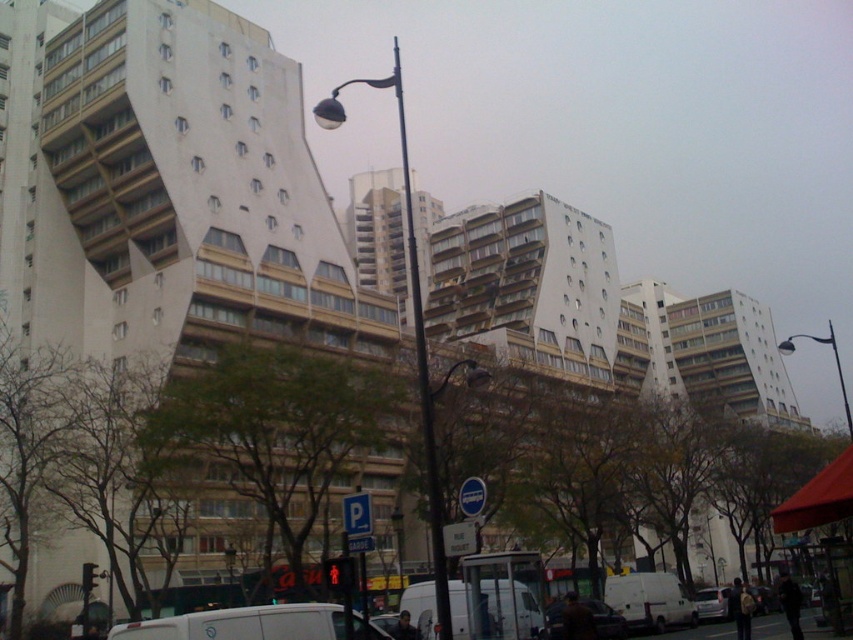
Question: Considering the real-world distances, which object is farthest from the white matte van at lower center?

Choices:
 (A) matte black street light at center
 (B) metallic pole at right
 (C) black metal pole at center
 (D) silver metallic van at lower right

Answer: (B)

Question: Is black metal pole at center positioned before metallic silver car at center?

Choices:
 (A) no
 (B) yes

Answer: (B)

Question: Does matte black street light at center lie in front of white matte van at lower center?

Choices:
 (A) yes
 (B) no

Answer: (B)

Question: Which point is farther to the camera?

Choices:
 (A) (704, 593)
 (B) (248, 625)
 (C) (793, 342)
 (D) (599, 628)

Answer: (C)

Question: Is matte black street light at center closer to camera compared to silver metallic van at lower right?

Choices:
 (A) no
 (B) yes

Answer: (B)

Question: Which object appears closest to the camera in this image?

Choices:
 (A) black metal pole at center
 (B) white matte van at lower center

Answer: (B)